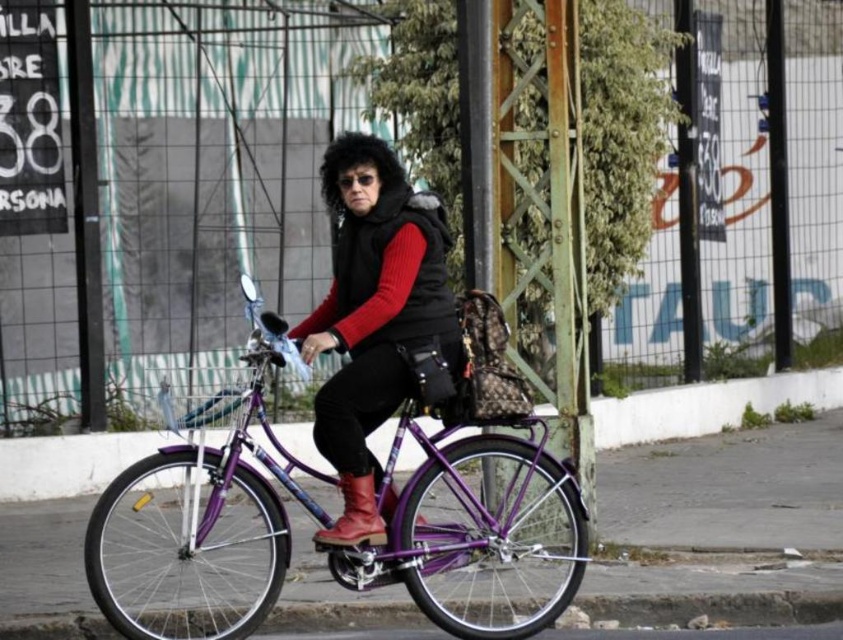
Question: Which point is closer to the camera taking this photo?

Choices:
 (A) (371, 483)
 (B) (380, 276)

Answer: (B)

Question: Which object is positioned farthest from the leather boot at center?

Choices:
 (A) matte black vest at center
 (B) purple metallic bicycle at center

Answer: (B)

Question: Is purple metallic bicycle at center below matte black vest at center?

Choices:
 (A) yes
 (B) no

Answer: (A)

Question: Considering the relative positions of purple metallic bicycle at center and leather boot at center in the image provided, where is purple metallic bicycle at center located with respect to leather boot at center?

Choices:
 (A) left
 (B) right

Answer: (A)

Question: Which of the following is the farthest from the observer?

Choices:
 (A) purple metallic bicycle at center
 (B) leather boot at center
 (C) matte black vest at center

Answer: (B)

Question: Does purple metallic bicycle at center appear over matte black vest at center?

Choices:
 (A) yes
 (B) no

Answer: (B)